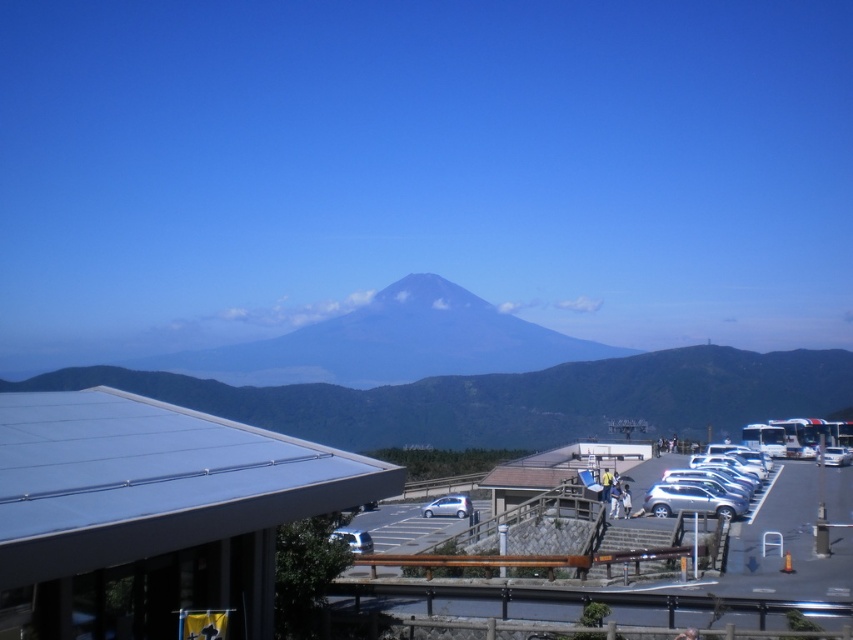
Can you confirm if silver metallic car at center is taller than white metallic car at right?

Yes, silver metallic car at center is taller than white metallic car at right.

Does silver metallic car at center lie in front of white metallic car at right?

Yes, it is.

Locate an element on the screen. silver metallic car at center is located at coordinates (448, 506).

Locate an element on the screen. This screenshot has width=853, height=640. silver metallic car at center is located at coordinates point(448,506).

Which is more to the left, gray/smooth mountain at center or white metallic car at right?

gray/smooth mountain at center

Does gray/smooth mountain at center have a greater width compared to white metallic car at right?

Indeed, gray/smooth mountain at center has a greater width compared to white metallic car at right.

Does point (152, 372) come farther from viewer compared to point (849, 458)?

Yes, it is behind point (849, 458).

In order to click on gray/smooth mountain at center in this screenshot , I will do `click(514, 397)`.

Is point (689, 509) farther from viewer compared to point (838, 454)?

No, it is not.

Does silver metallic suv at center-right appear on the right side of white metallic car at right?

In fact, silver metallic suv at center-right is to the left of white metallic car at right.

Which is behind, point (712, 504) or point (849, 460)?

The point (849, 460) is more distant.

Where is `silver metallic suv at center-right`? Image resolution: width=853 pixels, height=640 pixels. silver metallic suv at center-right is located at coordinates (689, 500).